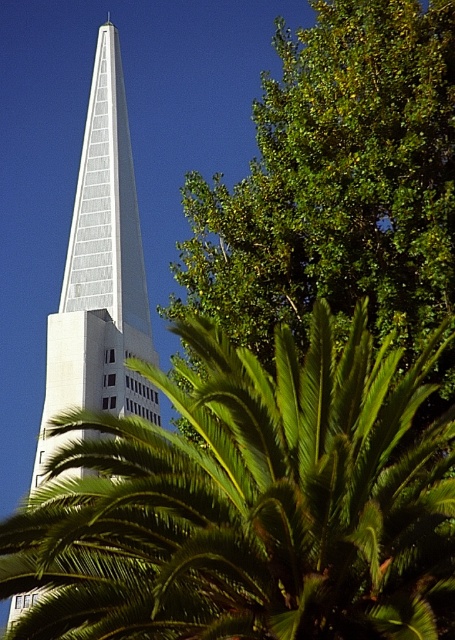
Question: Is green leafy palm tree at lower left to the left of green leafy tree at upper right from the viewer's perspective?

Choices:
 (A) no
 (B) yes

Answer: (B)

Question: Does green leafy tree at upper right appear on the right side of glassy white spire at center?

Choices:
 (A) yes
 (B) no

Answer: (A)

Question: Which of the following is the farthest from the observer?

Choices:
 (A) (172, 456)
 (B) (394, 17)
 (C) (124, 262)

Answer: (C)

Question: Which object appears farthest from the camera in this image?

Choices:
 (A) glassy white spire at center
 (B) green leafy palm tree at lower left

Answer: (A)

Question: Can you confirm if green leafy palm tree at lower left is wider than glassy white spire at center?

Choices:
 (A) no
 (B) yes

Answer: (B)

Question: Which point appears closest to the camera in this image?

Choices:
 (A) (345, 589)
 (B) (71, 285)
 (C) (362, 10)

Answer: (A)